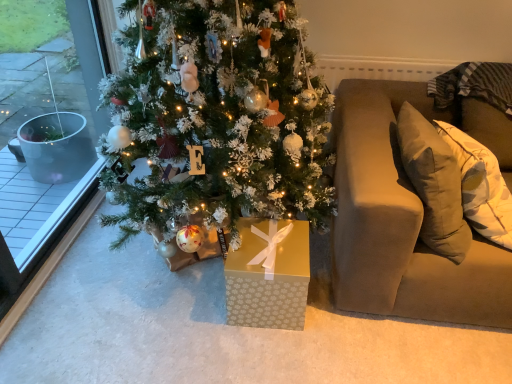
Question: Does white frosted christmas tree at center contain beige fabric couch at right?

Choices:
 (A) no
 (B) yes

Answer: (A)

Question: Does white frosted christmas tree at center have a greater width compared to beige fabric couch at right?

Choices:
 (A) no
 (B) yes

Answer: (B)

Question: From a real-world perspective, is white frosted christmas tree at center located higher than beige fabric couch at right?

Choices:
 (A) yes
 (B) no

Answer: (A)

Question: From the image's perspective, is white frosted christmas tree at center beneath beige fabric couch at right?

Choices:
 (A) no
 (B) yes

Answer: (A)

Question: Does white frosted christmas tree at center have a lesser width compared to beige fabric couch at right?

Choices:
 (A) yes
 (B) no

Answer: (B)

Question: Considering the positions of beige fabric couch at right and white frosted christmas tree at center in the image, is beige fabric couch at right bigger or smaller than white frosted christmas tree at center?

Choices:
 (A) big
 (B) small

Answer: (B)

Question: Looking at their shapes, would you say beige fabric couch at right is wider or thinner than white frosted christmas tree at center?

Choices:
 (A) wide
 (B) thin

Answer: (B)

Question: Is beige fabric couch at right in front of or behind white frosted christmas tree at center in the image?

Choices:
 (A) front
 (B) behind

Answer: (B)

Question: Visually, is beige fabric couch at right positioned to the left or to the right of white frosted christmas tree at center?

Choices:
 (A) right
 (B) left

Answer: (A)

Question: Is clear glass window at left spatially inside beige fabric couch at right, or outside of it?

Choices:
 (A) outside
 (B) inside

Answer: (A)

Question: Is point (33, 208) closer or farther from the camera than point (437, 283)?

Choices:
 (A) farther
 (B) closer

Answer: (A)

Question: Considering the positions of clear glass window at left and beige fabric couch at right in the image, is clear glass window at left bigger or smaller than beige fabric couch at right?

Choices:
 (A) small
 (B) big

Answer: (A)

Question: Is clear glass window at left taller or shorter than beige fabric couch at right?

Choices:
 (A) short
 (B) tall

Answer: (B)

Question: Considering the relative positions of gold paper gift box at center and clear glass window at left in the image provided, is gold paper gift box at center to the left or to the right of clear glass window at left?

Choices:
 (A) left
 (B) right

Answer: (B)

Question: From a real-world perspective, relative to clear glass window at left, is gold paper gift box at center vertically above or below?

Choices:
 (A) below
 (B) above

Answer: (A)